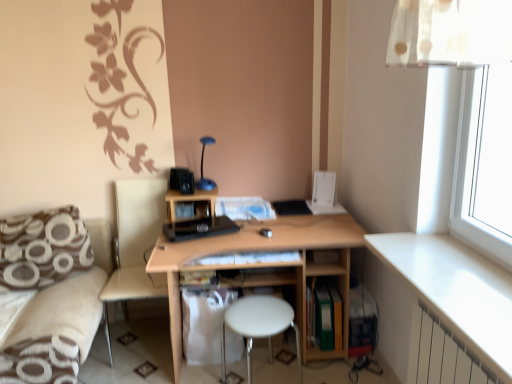
Locate an element on the screen. The image size is (512, 384). blank space situated above white paper at center, which is counted as the 2th book, starting from the left (from a real-world perspective) is located at coordinates (246, 205).